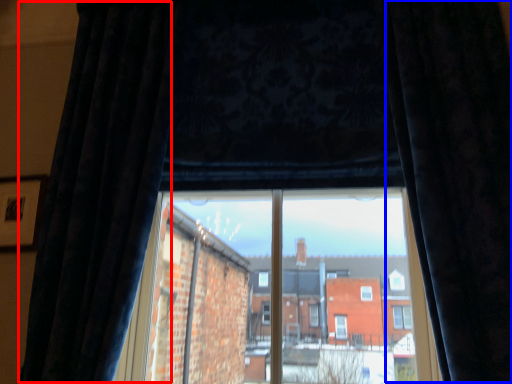
Question: Which point is closer to the camera, curtain (highlighted by a red box) or curtain (highlighted by a blue box)?

Choices:
 (A) curtain
 (B) curtain

Answer: (B)